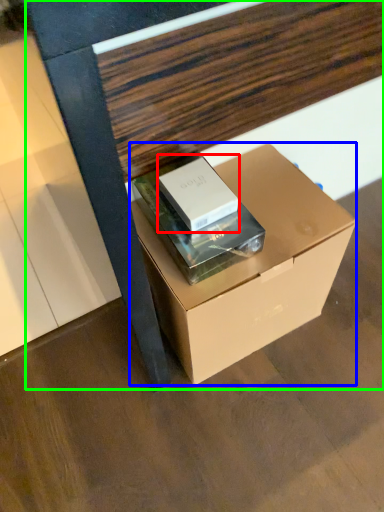
Question: Based on their relative distances, which object is farther from box (highlighted by a red box)? Choose from box (highlighted by a blue box) and furniture (highlighted by a green box).

Choices:
 (A) box
 (B) furniture

Answer: (B)